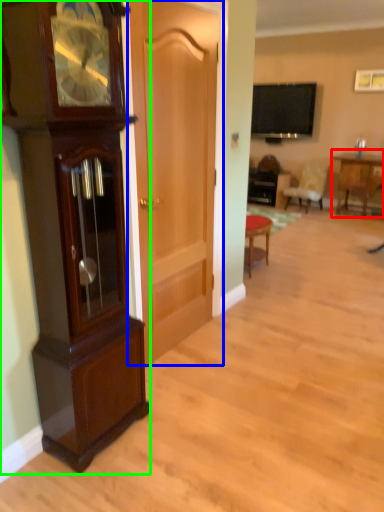
Question: Which object is positioned farthest from table (highlighted by a red box)? Select from door (highlighted by a blue box) and cabinetry (highlighted by a green box).

Choices:
 (A) door
 (B) cabinetry

Answer: (B)